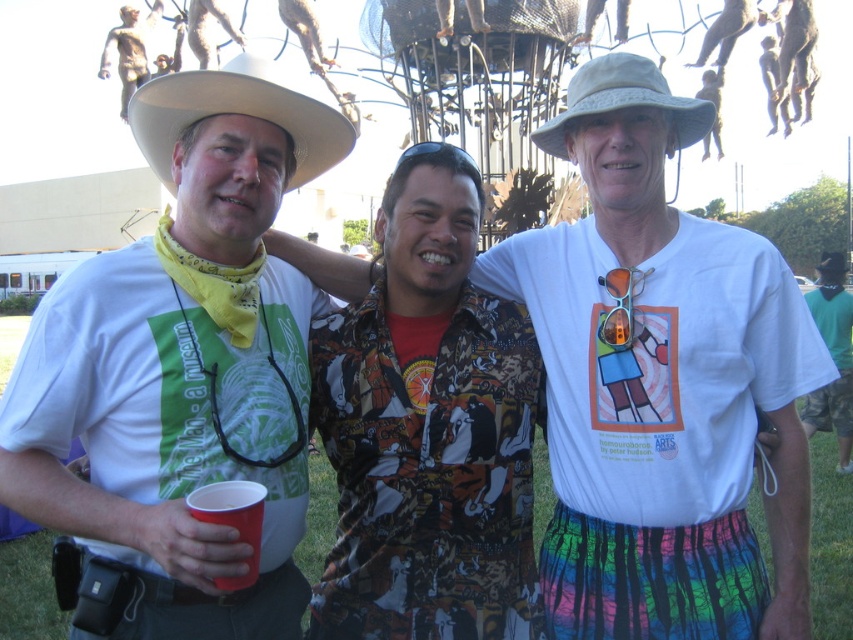
Question: Which object is positioned closest to the white cotton shirt at center?

Choices:
 (A) red plastic cup at lower left
 (B) white matte cowboy hat at upper left
 (C) beige straw hat at center

Answer: (C)

Question: Does white matte cowboy hat at left have a lesser width compared to red plastic cup at lower left?

Choices:
 (A) yes
 (B) no

Answer: (B)

Question: Among these objects, which one is farthest from the camera?

Choices:
 (A) red plastic cup at lower left
 (B) beige straw hat at center

Answer: (B)

Question: Can you confirm if beige straw hat at center is wider than red plastic cup at lower left?

Choices:
 (A) no
 (B) yes

Answer: (B)

Question: Which point appears farthest from the camera in this image?

Choices:
 (A) (254, 58)
 (B) (310, 140)

Answer: (B)

Question: Can you confirm if beige straw hat at center is positioned below red plastic cup at lower left?

Choices:
 (A) no
 (B) yes

Answer: (A)